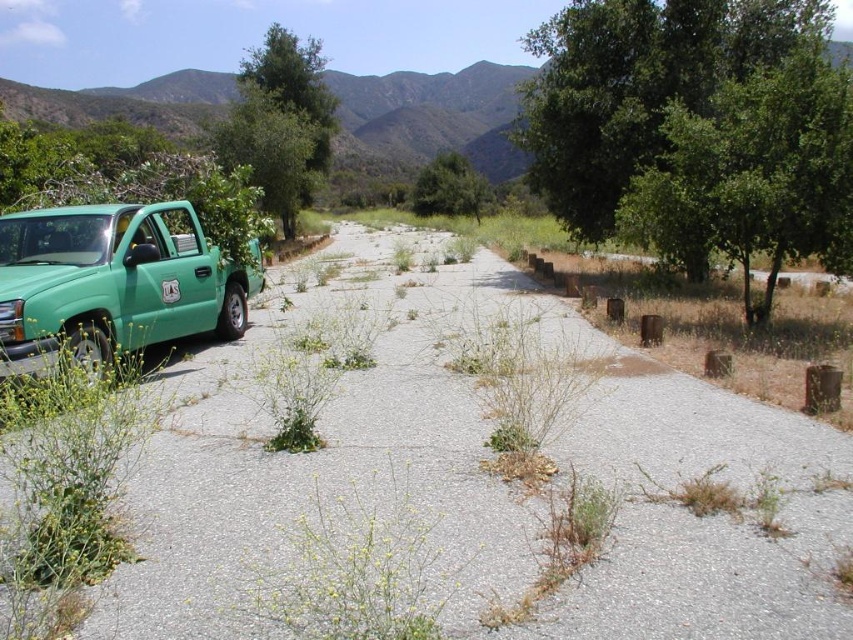
Is point (125, 624) less distant than point (485, 208)?

That is True.

Can you confirm if gray gravel at left is shorter than green leafy tree at center?

Yes.

Who is more distant from viewer, (721,416) or (457,168)?

The point (457,168) is more distant.

Where is `gray gravel at left`? Image resolution: width=853 pixels, height=640 pixels. gray gravel at left is located at coordinates (480, 477).

Can you confirm if green matte truck at left is positioned to the right of green leafy tree at center?

Incorrect, green matte truck at left is not on the right side of green leafy tree at center.

Consider the image. Is green matte truck at left wider than green leafy tree at center?

No, green matte truck at left is not wider than green leafy tree at center.

Measure the distance between green matte truck at left and camera.

The distance of green matte truck at left from camera is 18.65 feet.

At what (x,y) coordinates should I click in order to perform the action: click on green matte truck at left. Please return your answer as a coordinate pair (x, y). The height and width of the screenshot is (640, 853). Looking at the image, I should click on (115, 280).

Locate an element on the screen. The height and width of the screenshot is (640, 853). green leafy tree at upper left is located at coordinates (281, 122).

The height and width of the screenshot is (640, 853). What do you see at coordinates (281, 122) in the screenshot?
I see `green leafy tree at upper left` at bounding box center [281, 122].

This screenshot has width=853, height=640. In order to click on green leafy tree at upper left in this screenshot , I will do `click(281, 122)`.